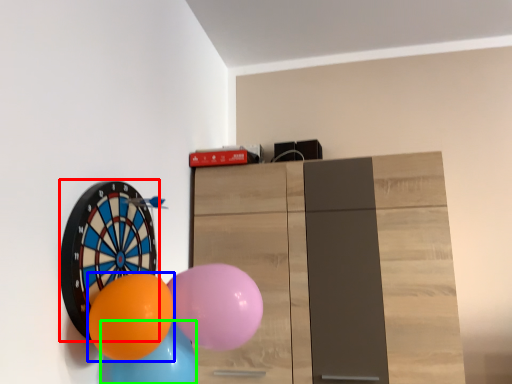
Question: Which object is the closest to the balloon (highlighted by a red box)? Choose among these: balloon (highlighted by a blue box) or balloon (highlighted by a green box).

Choices:
 (A) balloon
 (B) balloon

Answer: (A)